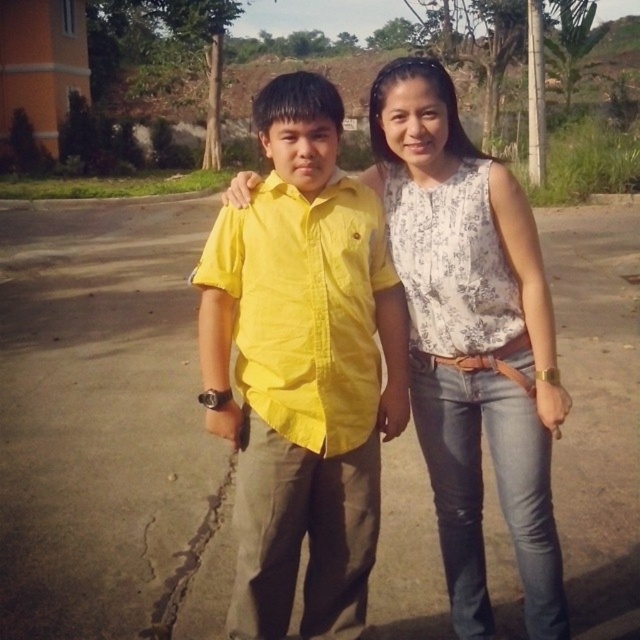
Question: Does yellow cotton shirt at center come in front of white floral blouse at center?

Choices:
 (A) no
 (B) yes

Answer: (B)

Question: Can you confirm if yellow cotton shirt at center is positioned to the left of white floral blouse at center?

Choices:
 (A) no
 (B) yes

Answer: (B)

Question: Is yellow cotton shirt at center wider than white floral blouse at center?

Choices:
 (A) yes
 (B) no

Answer: (B)